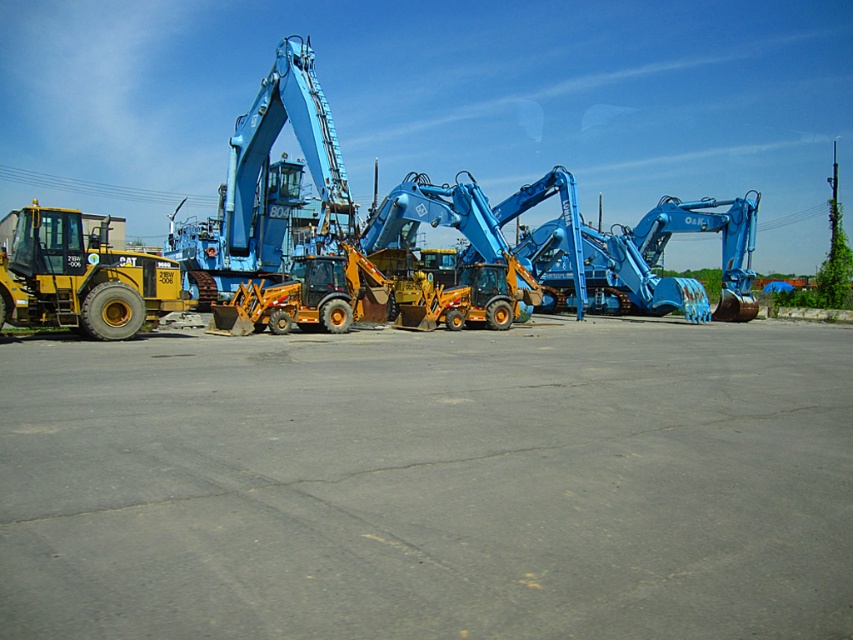
Which is in front, point (399, 538) or point (276, 122)?

Point (399, 538) is in front.

Measure the distance between gray asphalt parking lot at center and camera.

3.16 meters

What do you see at coordinates (430, 483) in the screenshot?
I see `gray asphalt parking lot at center` at bounding box center [430, 483].

The image size is (853, 640). What are the coordinates of `gray asphalt parking lot at center` in the screenshot? It's located at (430, 483).

Is gray asphalt parking lot at center above matte yellow tractor at left?

Actually, gray asphalt parking lot at center is below matte yellow tractor at left.

Is point (728, 422) positioned in front of point (68, 323)?

That is True.

Locate an element on the screen. gray asphalt parking lot at center is located at coordinates (430, 483).

Between matte blue excavator at center and matte yellow tractor at left, which one has more height?

matte blue excavator at center

How much distance is there between matte blue excavator at center and matte yellow tractor at left?

matte blue excavator at center is 14.27 meters from matte yellow tractor at left.

Which is behind, point (259, 188) or point (67, 266)?

Positioned behind is point (259, 188).

The width and height of the screenshot is (853, 640). In order to click on matte blue excavator at center in this screenshot , I will do `click(268, 182)`.